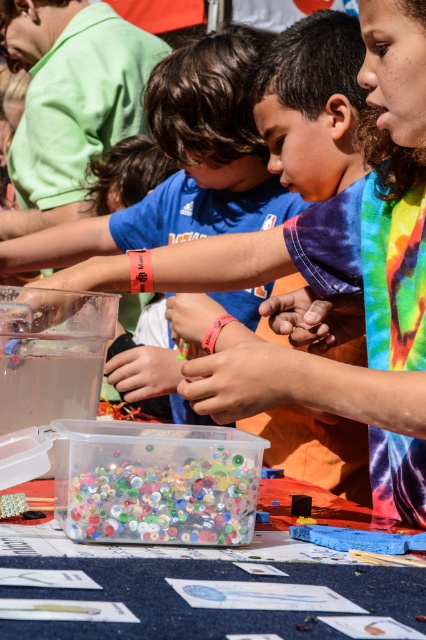
The height and width of the screenshot is (640, 426). I want to click on translucent plastic container at center, so click(161, 497).

Is translucent plastic container at lower center to the right of matte plastic hand at center from the viewer's perspective?

Indeed, translucent plastic container at lower center is positioned on the right side of matte plastic hand at center.

Does translucent plastic container at lower center come in front of matte plastic hand at center?

Yes, it is.

Who is more distant from viewer, (354, 566) or (172, 380)?

The point (172, 380) is behind.

Where is `translucent plastic container at lower center`? The width and height of the screenshot is (426, 640). translucent plastic container at lower center is located at coordinates (210, 609).

Which is above, smooth skin at center or brown leather hand at center?

brown leather hand at center is above.

Which is behind, point (271, 356) or point (359, 332)?

The point (359, 332) is more distant.

Find the location of a particular element. smooth skin at center is located at coordinates (241, 380).